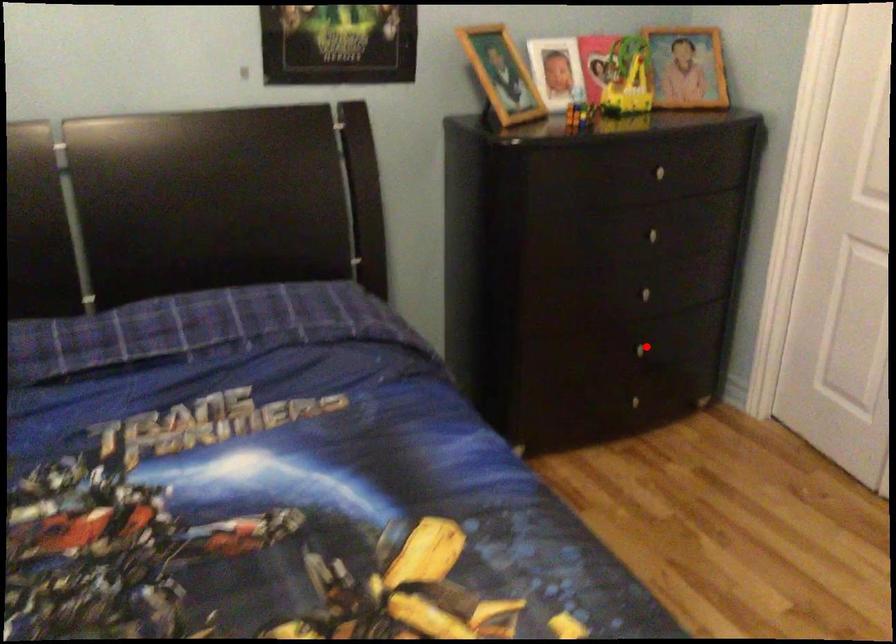
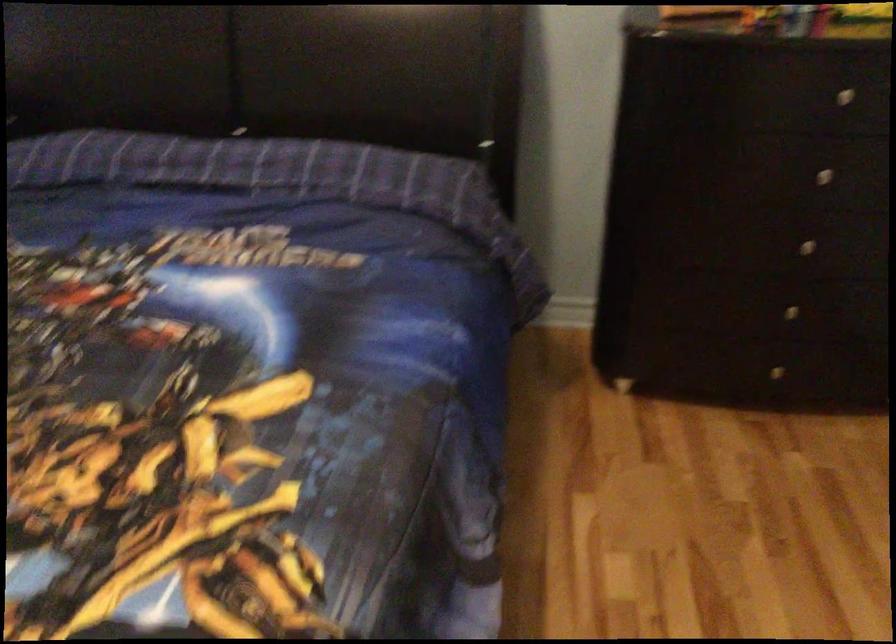
Find the pixel in the second image that matches the highlighted location in the first image.

(790, 310)